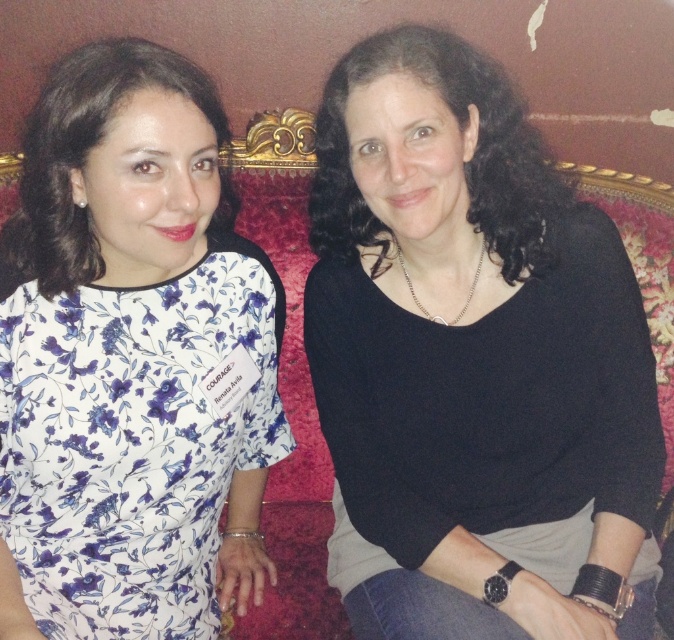
You are a fashion designer working on a new collection. You need to place a 12 inch wide accessory between the black matte sweater at center and the floral print fabric dress at left. Is there enough space to fit it?

The black matte sweater at center is 11.14 inches away from the floral print fabric dress at left. Since the accessory is 12 inches wide, there isn t enough space to fit it between them.

You are a fashion designer observing two outfits in the image. The black matte sweater at center and the floral print fabric dress at left. Which outfit is positioned to the right side of the other?

The black matte sweater at center is to the right of the floral print fabric dress at left.

You are a fashion designer reviewing a photo shoot. In the image, you see a black matte sweater at center and a floral print fabric dress at left. Which clothing item appears taller in the image?

The black matte sweater at center is taller than the floral print fabric dress at left according to the description.